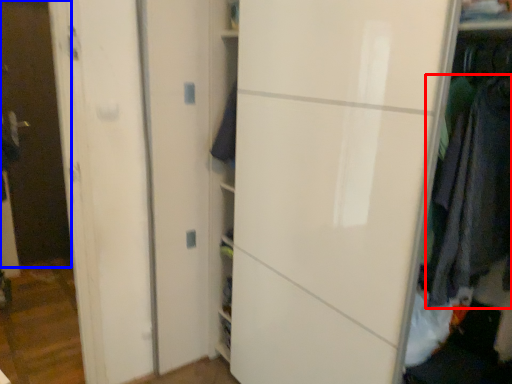
Question: Which of the following is the farthest to the observer, clothing (highlighted by a red box) or glass door (highlighted by a blue box)?

Choices:
 (A) clothing
 (B) glass door

Answer: (B)